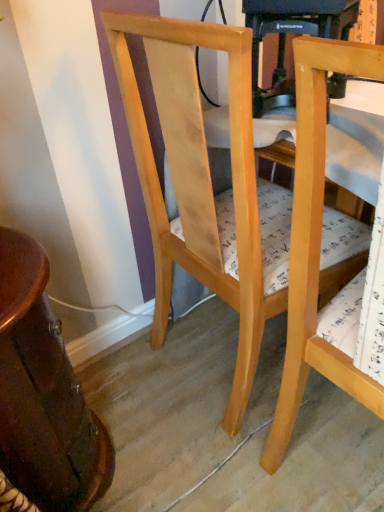
Question: Which direction should I rotate to face light wood chair at center, which is the second chair in right-to-left order, — up or down?

Choices:
 (A) up
 (B) down

Answer: (A)

Question: From a real-world perspective, is natural wood chair at right, acting as the second chair starting from the left, on top of light wood chair at center, which is the second chair in right-to-left order?

Choices:
 (A) no
 (B) yes

Answer: (B)

Question: From a real-world perspective, is natural wood chair at right, the first chair viewed from the right, under light wood chair at center, which is the second chair in right-to-left order?

Choices:
 (A) yes
 (B) no

Answer: (B)

Question: Is natural wood chair at right, the first chair viewed from the right, to the left of light wood chair at center, which is the second chair in right-to-left order, from the viewer's perspective?

Choices:
 (A) no
 (B) yes

Answer: (A)

Question: Could you tell me if natural wood chair at right, acting as the second chair starting from the left, is turned towards light wood chair at center, which is the 1th chair in left-to-right order?

Choices:
 (A) no
 (B) yes

Answer: (A)

Question: Is the depth of natural wood chair at right, the first chair viewed from the right, greater than that of light wood chair at center, which is the second chair in right-to-left order?

Choices:
 (A) no
 (B) yes

Answer: (A)

Question: Is natural wood chair at right, the first chair viewed from the right, shorter than light wood chair at center, which is the second chair in right-to-left order?

Choices:
 (A) yes
 (B) no

Answer: (B)

Question: Is wooden table at left touching light wood chair at center, which is the 1th chair in left-to-right order?

Choices:
 (A) no
 (B) yes

Answer: (A)

Question: Is light wood chair at center, which is the 1th chair in left-to-right order, inside wooden table at left?

Choices:
 (A) no
 (B) yes

Answer: (A)

Question: Does wooden table at left have a lesser height compared to light wood chair at center, which is the second chair in right-to-left order?

Choices:
 (A) yes
 (B) no

Answer: (A)

Question: Is wooden table at left not inside light wood chair at center, which is the second chair in right-to-left order?

Choices:
 (A) yes
 (B) no

Answer: (A)

Question: Considering the relative positions of wooden table at left and light wood chair at center, which is the second chair in right-to-left order, in the image provided, is wooden table at left in front of light wood chair at center, which is the second chair in right-to-left order,?

Choices:
 (A) yes
 (B) no

Answer: (B)

Question: Can you confirm if wooden table at left is thinner than light wood chair at center, which is the 1th chair in left-to-right order?

Choices:
 (A) no
 (B) yes

Answer: (B)

Question: Can you confirm if natural wood chair at right, the first chair viewed from the right, is smaller than wooden table at left?

Choices:
 (A) yes
 (B) no

Answer: (B)